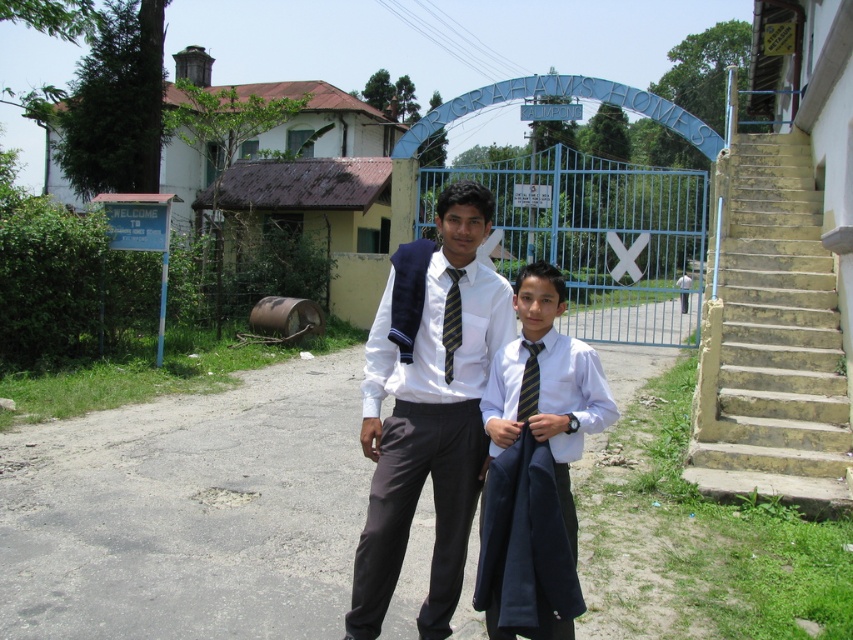
You are standing at the point marked by the coordinate point at (849, 444). You want to take a photo of the two individuals who are 5.84 meters apart. Which individual should you position closer to the camera to ensure both are in focus?

Both individuals are 5.84 meters apart, so positioning the one closer to the camera will ensure both are in focus.

Based on the scene, which object is positioned closer to the camera between the white shirt and tie at center and the yellow striped tie at center?

The white shirt and tie at center is closer to the viewer than the yellow striped tie at center.

Looking at the two people in the scene, which clothing item is positioned to the left of the other? Specifically, is the matte white shirt at center to the left or right of the yellow striped tie at center?

The matte white shirt at center is to the left of the yellow striped tie at center according to the description.